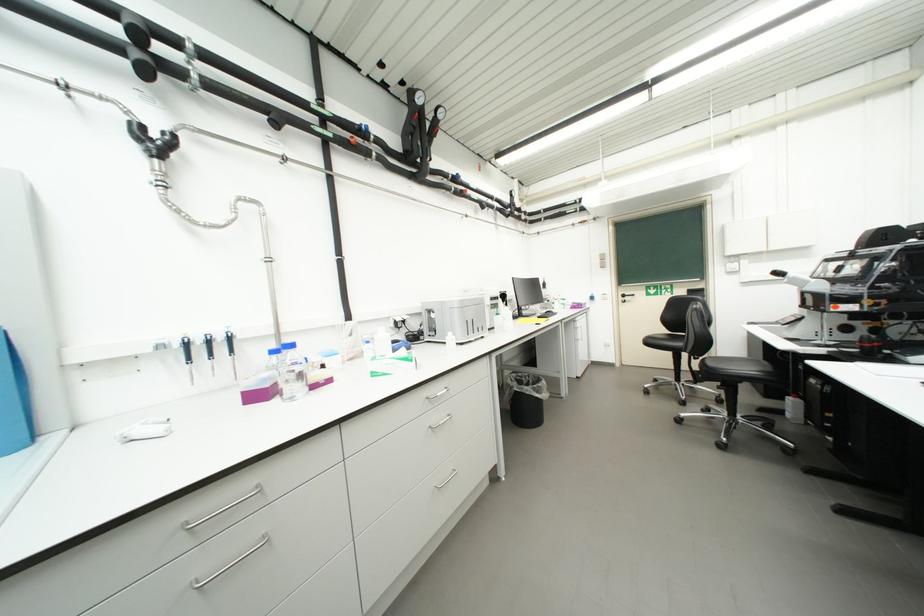
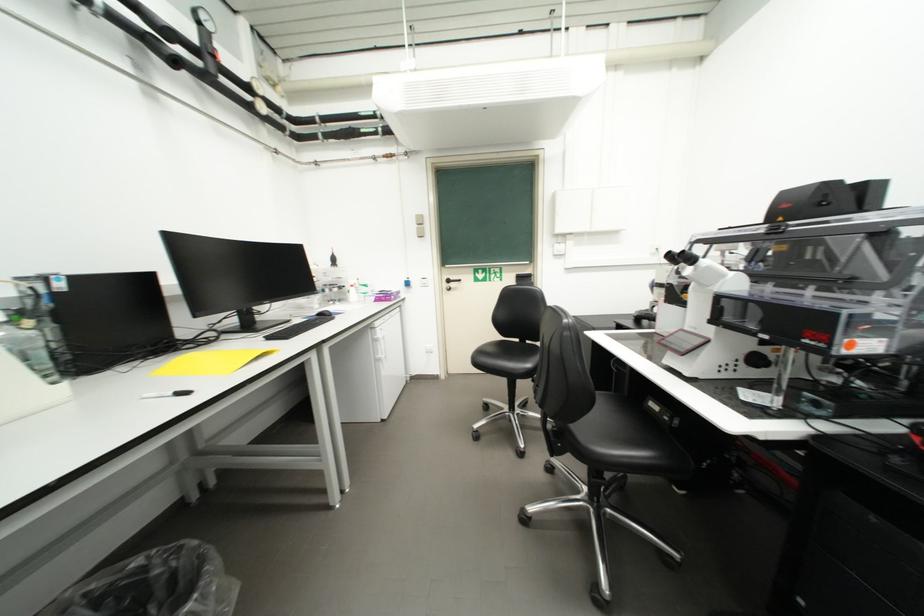
The point at (x=659, y=344) is marked in the first image. Where is the corresponding point in the second image?

(490, 362)